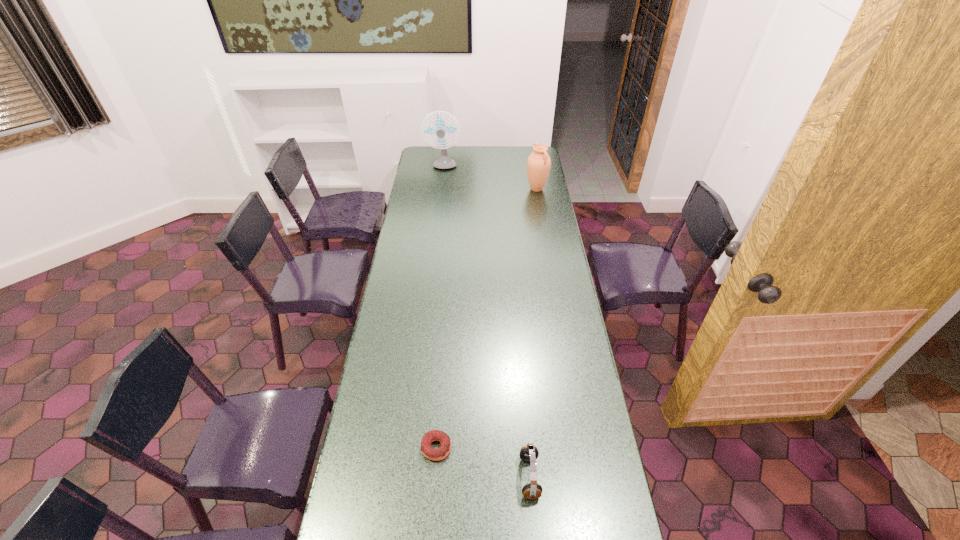
At what (x,y) coordinates should I click in order to perform the action: click on vacant space at the far left corner of the desktop. Please return your answer as a coordinate pair (x, y). The image size is (960, 540). Looking at the image, I should click on (424, 159).

Locate an element on the screen. This screenshot has width=960, height=540. unoccupied area between the doughnut and the second object from right to left is located at coordinates (483, 462).

Image resolution: width=960 pixels, height=540 pixels. What are the coordinates of `free space between the shortest object and the headset` in the screenshot? It's located at (483, 462).

The width and height of the screenshot is (960, 540). What are the coordinates of `vacant area that lies between the farthest object and the doughnut` in the screenshot? It's located at (440, 308).

You are a GUI agent. You are given a task and a screenshot of the screen. Output one action in this format:
    pyautogui.click(x=<x>, y=<y>)
    Task: Click on the free spot between the second shortest object and the doughnut
    This screenshot has width=960, height=540.
    Given the screenshot: What is the action you would take?
    pyautogui.click(x=483, y=462)

Locate an element on the screen. The width and height of the screenshot is (960, 540). free space between the doughnut and the fan is located at coordinates [440, 308].

Image resolution: width=960 pixels, height=540 pixels. Find the location of `free space between the doughnut and the rightmost object`. free space between the doughnut and the rightmost object is located at coordinates 487,319.

The image size is (960, 540). In order to click on free spot between the tallest object and the rightmost object in this screenshot , I will do `click(490, 178)`.

Locate an element on the screen. This screenshot has height=540, width=960. free space between the tallest object and the doughnut is located at coordinates (440, 308).

I want to click on free point between the third nearest object and the shortest object, so click(487, 319).